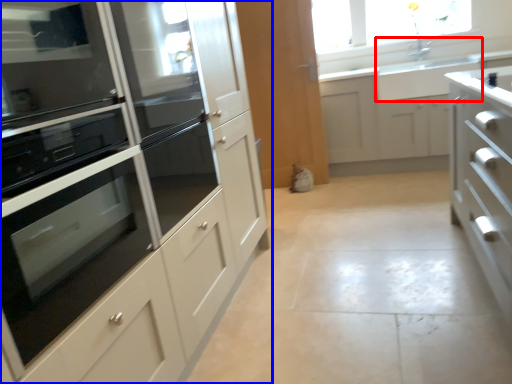
Question: Which of the following is the closest to the observer, sink (highlighted by a red box) or cabinetry (highlighted by a blue box)?

Choices:
 (A) sink
 (B) cabinetry

Answer: (B)